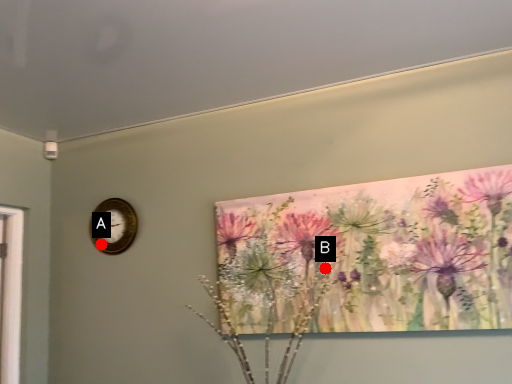
Question: Two points are circled on the image, labeled by A and B beside each circle. Which point is further to the camera?

Choices:
 (A) A is further
 (B) B is further

Answer: (A)